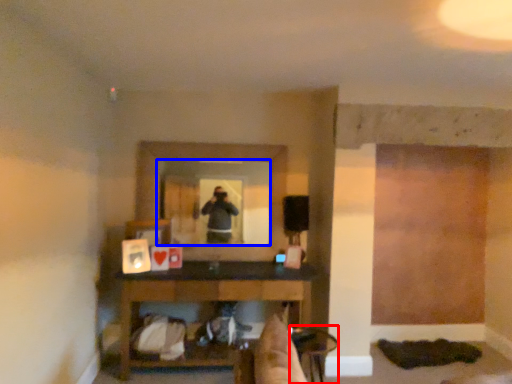
Question: Which point is further to the camera, chair (highlighted by a red box) or mirror (highlighted by a blue box)?

Choices:
 (A) chair
 (B) mirror

Answer: (B)